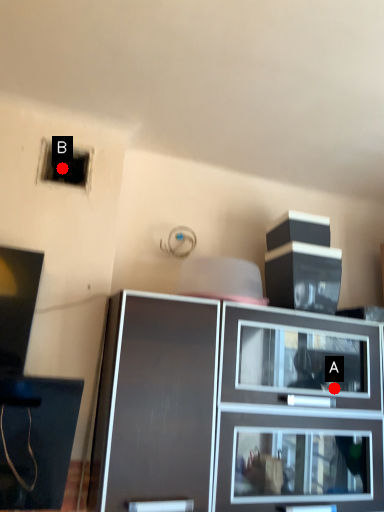
Question: Two points are circled on the image, labeled by A and B beside each circle. Among these points, which one is farthest from the camera?

Choices:
 (A) A is further
 (B) B is further

Answer: (B)